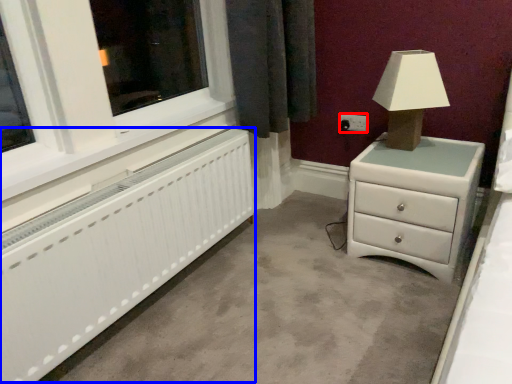
Question: Which object appears closest to the camera in this image, electric outlet (highlighted by a red box) or radiator (highlighted by a blue box)?

Choices:
 (A) electric outlet
 (B) radiator

Answer: (B)